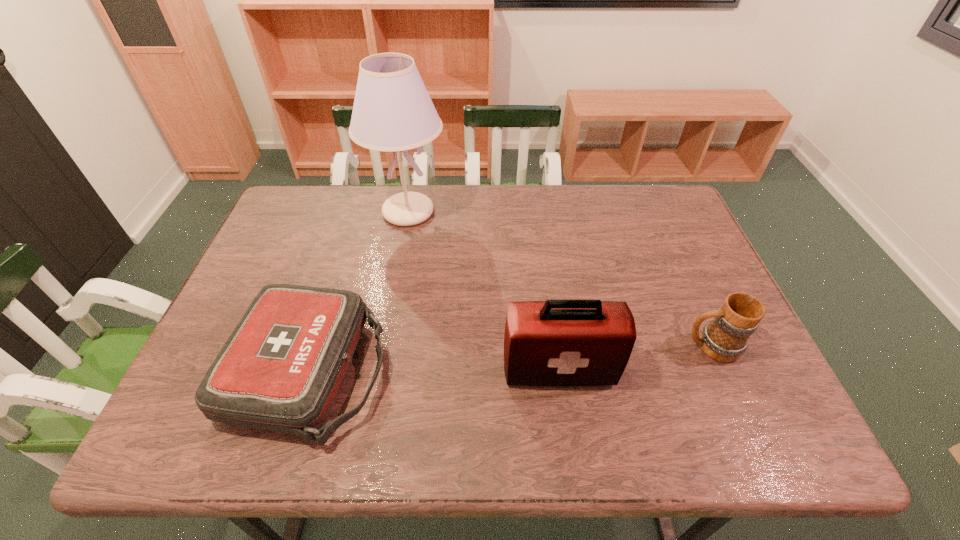
This screenshot has width=960, height=540. I want to click on vacant area at the near edge, so click(x=439, y=432).

You are a GUI agent. You are given a task and a screenshot of the screen. Output one action in this format:
    pyautogui.click(x=<x>, y=<y>)
    Task: Click on the vacant space at the left edge of the desktop
    
    Given the screenshot: What is the action you would take?
    pyautogui.click(x=266, y=238)

Image resolution: width=960 pixels, height=540 pixels. Find the location of `vacant space at the right edge`. vacant space at the right edge is located at coordinates (686, 296).

The image size is (960, 540). In the image, there is a desktop. What are the coordinates of `vacant space at the far left corner` in the screenshot? It's located at (306, 201).

The image size is (960, 540). Find the location of `free area in between the mug and the tallest object`. free area in between the mug and the tallest object is located at coordinates (560, 279).

This screenshot has height=540, width=960. I want to click on free space between the rightmost object and the lampshade, so click(560, 279).

At what (x,y) coordinates should I click in order to perform the action: click on free space between the left first-aid kit and the lampshade. Please return your answer as a coordinate pair (x, y). This screenshot has height=540, width=960. Looking at the image, I should click on (359, 292).

At what (x,y) coordinates should I click in order to perform the action: click on free space between the rightmost object and the right first-aid kit. Please return your answer as a coordinate pair (x, y). Image resolution: width=960 pixels, height=540 pixels. Looking at the image, I should click on (635, 358).

This screenshot has width=960, height=540. What are the coordinates of `vacant area between the left first-aid kit and the right first-aid kit` in the screenshot? It's located at (434, 370).

Find the location of a particular element. The image size is (960, 540). free spot between the second shortest object and the tallest object is located at coordinates (560, 279).